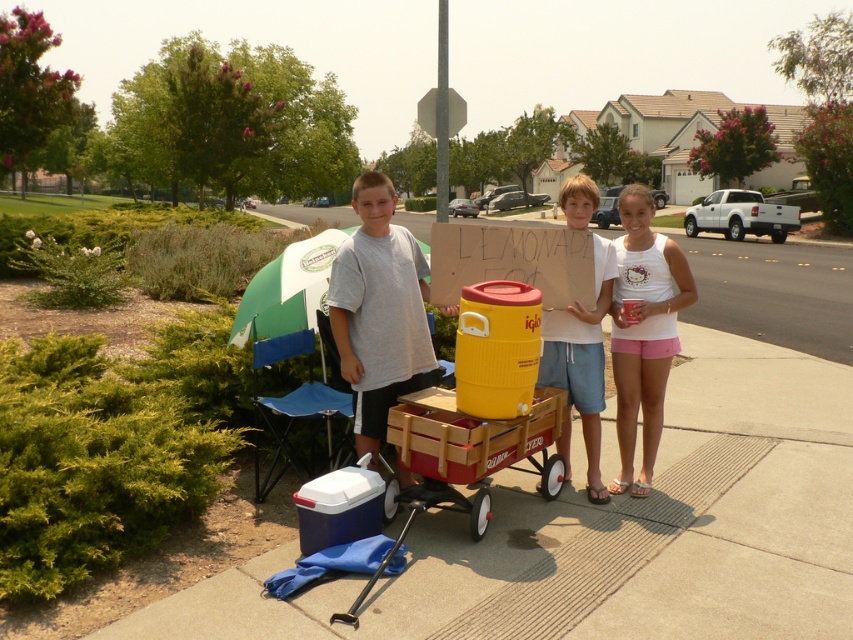
You are a customer walking on the sidewalk towards the lemonade stand. Which of the two points, point (500, 454) or point (584, 396), will you encounter first?

Point (500, 454) is in front of point (584, 396), so you will encounter point (500, 454) first.